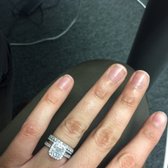
I want to click on table leg, so click(147, 37).